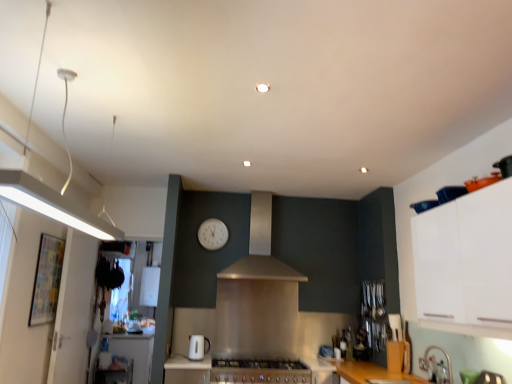
Question: Does white glossy toaster at lower center come in front of metallic stainless steel countertop at lower center?

Choices:
 (A) yes
 (B) no

Answer: (B)

Question: From the image's perspective, is white glossy toaster at lower center located beneath metallic stainless steel countertop at lower center?

Choices:
 (A) no
 (B) yes

Answer: (A)

Question: Would you say metallic stainless steel countertop at lower center is part of white glossy toaster at lower center's contents?

Choices:
 (A) yes
 (B) no

Answer: (B)

Question: Is white glossy toaster at lower center far from metallic stainless steel countertop at lower center?

Choices:
 (A) no
 (B) yes

Answer: (A)

Question: Considering the relative sizes of white glossy toaster at lower center and metallic stainless steel countertop at lower center in the image provided, is white glossy toaster at lower center smaller than metallic stainless steel countertop at lower center?

Choices:
 (A) yes
 (B) no

Answer: (A)

Question: Would you say white glossy counter top at lower left is to the left or to the right of white glossy toaster at lower center in the picture?

Choices:
 (A) right
 (B) left

Answer: (B)

Question: From a real-world perspective, relative to white glossy toaster at lower center, is white glossy counter top at lower left vertically above or below?

Choices:
 (A) above
 (B) below

Answer: (B)

Question: Considering the positions of white glossy counter top at lower left and white glossy toaster at lower center in the image, is white glossy counter top at lower left taller or shorter than white glossy toaster at lower center?

Choices:
 (A) tall
 (B) short

Answer: (A)

Question: Considering their positions, is white glossy counter top at lower left located in front of or behind white glossy toaster at lower center?

Choices:
 (A) behind
 (B) front

Answer: (A)

Question: From their relative heights in the image, would you say white matte cabinet at upper right is taller or shorter than metallic stainless steel countertop at lower center?

Choices:
 (A) tall
 (B) short

Answer: (A)

Question: Is white matte cabinet at upper right to the left or to the right of metallic stainless steel countertop at lower center in the image?

Choices:
 (A) left
 (B) right

Answer: (B)

Question: Is white matte cabinet at upper right inside the boundaries of metallic stainless steel countertop at lower center, or outside?

Choices:
 (A) inside
 (B) outside

Answer: (B)

Question: Looking at their shapes, would you say white matte cabinet at upper right is wider or thinner than metallic stainless steel countertop at lower center?

Choices:
 (A) wide
 (B) thin

Answer: (B)

Question: Choose the correct answer: Is white glossy counter top at lower left inside metallic stainless steel countertop at lower center or outside it?

Choices:
 (A) outside
 (B) inside

Answer: (A)

Question: From the image's perspective, is white glossy counter top at lower left above or below metallic stainless steel countertop at lower center?

Choices:
 (A) below
 (B) above

Answer: (A)